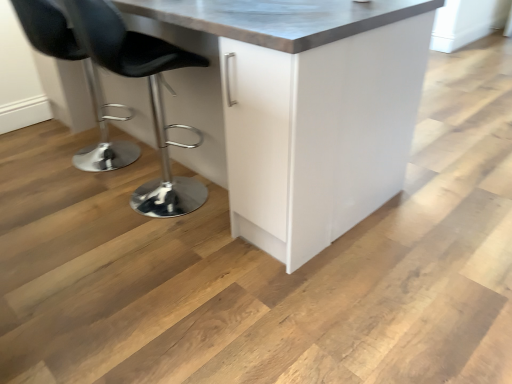
Find the location of `free space in front of black leather stool at left, arranged as the 2th chair when viewed from the left`. free space in front of black leather stool at left, arranged as the 2th chair when viewed from the left is located at coordinates (132, 259).